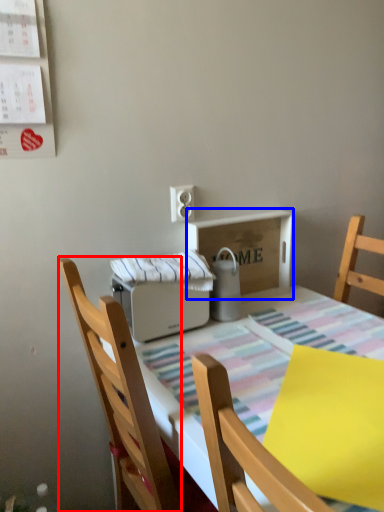
Question: Which of the following is the closest to the observer, chair (highlighted by a red box) or cardboard box (highlighted by a blue box)?

Choices:
 (A) chair
 (B) cardboard box

Answer: (A)